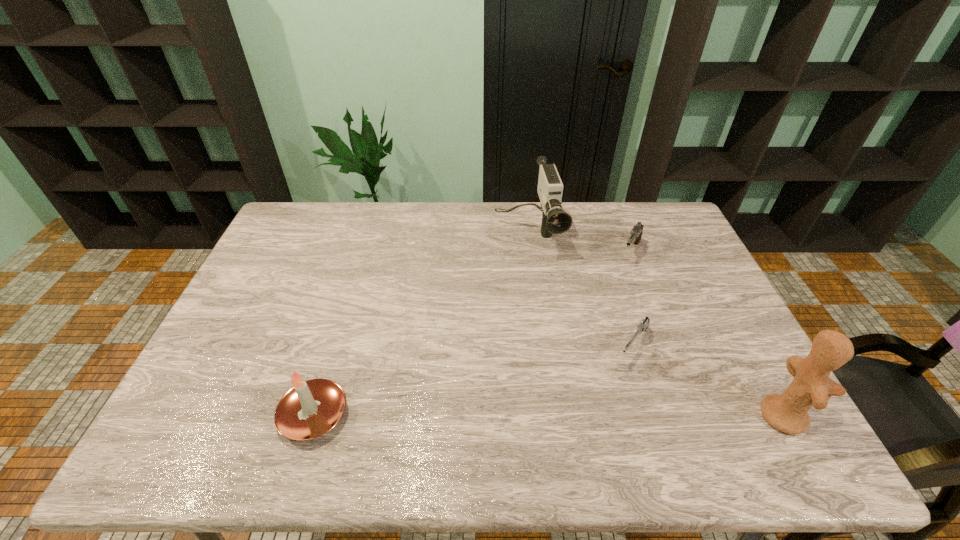
Locate an element on the screen. Image resolution: width=960 pixels, height=540 pixels. free space located 0.310m on the right of the leftmost object is located at coordinates (477, 415).

Identify the location of vacant space located on the front-facing side of the shortest object. This screenshot has height=540, width=960. tap(598, 400).

This screenshot has width=960, height=540. Find the location of `free space located on the front-facing side of the shortest object`. free space located on the front-facing side of the shortest object is located at coordinates (590, 411).

Where is `free space located on the front-facing side of the shortest object`? Image resolution: width=960 pixels, height=540 pixels. free space located on the front-facing side of the shortest object is located at coordinates (608, 387).

This screenshot has height=540, width=960. What are the coordinates of `free space located on the recording direction of the camcorder` in the screenshot? It's located at (538, 276).

Identify the location of vacant region located on the recording direction of the camcorder. This screenshot has height=540, width=960. (539, 281).

Find the location of `vacant region located on the recording direction of the camcorder`. vacant region located on the recording direction of the camcorder is located at coordinates (547, 316).

This screenshot has width=960, height=540. I want to click on vacant region located 0.230m at the barrel of the fourth tallest object, so click(604, 310).

Locate an element on the screen. vacant space situated 0.070m at the barrel of the fourth tallest object is located at coordinates (621, 278).

What are the coordinates of `vacant region located 0.240m at the barrel of the fourth tallest object` in the screenshot? It's located at (603, 312).